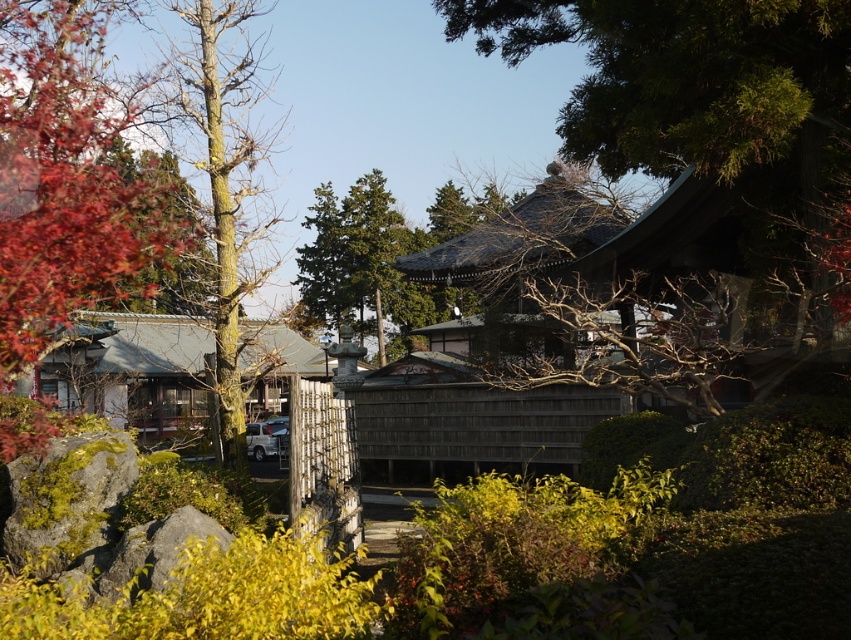
Is the position of green shingled roof at upper center less distant than that of reddish-brown bark tree at left?

No, it is behind reddish-brown bark tree at left.

Can you confirm if green shingled roof at upper center is positioned below reddish-brown bark tree at left?

Actually, green shingled roof at upper center is above reddish-brown bark tree at left.

Is point (604, 28) farther from viewer compared to point (3, 212)?

No.

Identify the location of green shingled roof at upper center. tap(681, 76).

Does wooden hut at center have a smaller size compared to yellowish bark tree at center?

Correct, wooden hut at center occupies less space than yellowish bark tree at center.

Does wooden hut at center come in front of yellowish bark tree at center?

That is True.

Does point (147, 397) lie behind point (233, 292)?

That is True.

The image size is (851, 640). What are the coordinates of `wooden hut at center` in the screenshot? It's located at (130, 371).

Can you confirm if green shingled roof at upper center is positioned above green textured tree at center?

No, green shingled roof at upper center is not above green textured tree at center.

Does green shingled roof at upper center come behind green textured tree at center?

No, it is in front of green textured tree at center.

Which is in front, point (610, 164) or point (375, 310)?

Point (610, 164) is more forward.

I want to click on green shingled roof at upper center, so click(x=681, y=76).